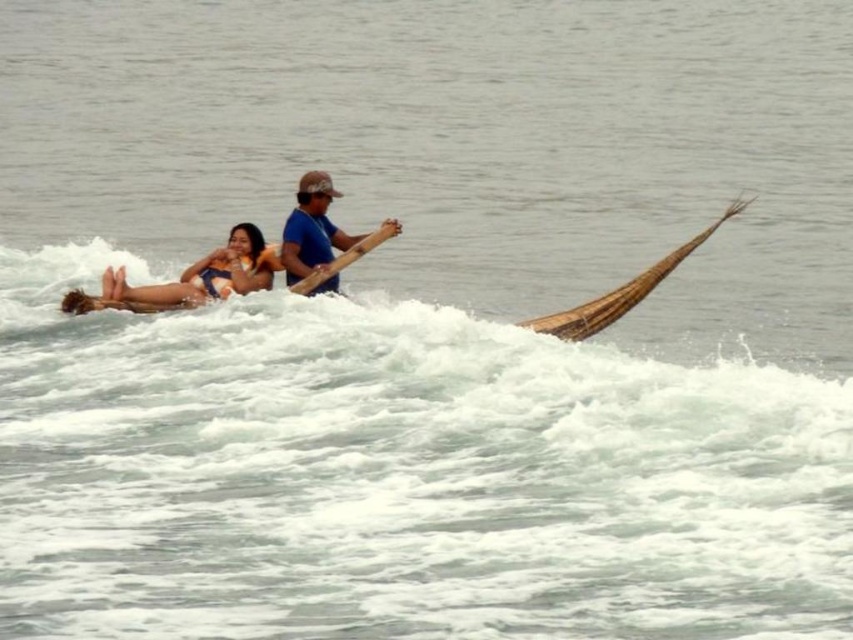
Question: Which point is closer to the camera?

Choices:
 (A) blue fabric shirt at center
 (B) orange bikini at center
 (C) brown woven canoe at right

Answer: (C)

Question: Can you confirm if orange bikini at center is positioned below orange bikini top at left?

Choices:
 (A) yes
 (B) no

Answer: (B)

Question: Which object is closer to the camera taking this photo?

Choices:
 (A) brown woven canoe at right
 (B) orange bikini at center
 (C) orange bikini top at left

Answer: (A)

Question: From the image, what is the correct spatial relationship of orange bikini at center in relation to brown woven canoe at right?

Choices:
 (A) below
 (B) above

Answer: (B)

Question: Which of these objects is positioned closest to the orange bikini at center?

Choices:
 (A) blue fabric shirt at center
 (B) brown woven canoe at right
 (C) orange bikini top at left

Answer: (A)

Question: Where is blue fabric shirt at center located in relation to brown woven canoe at right in the image?

Choices:
 (A) right
 (B) left

Answer: (B)